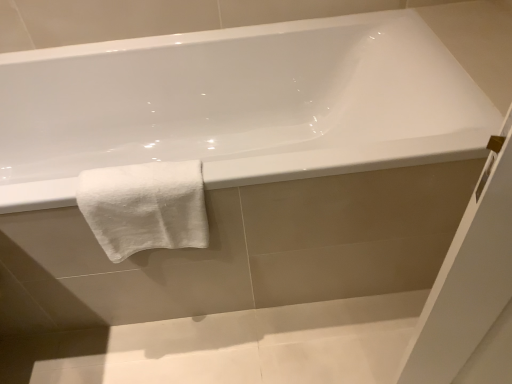
This screenshot has height=384, width=512. Find the location of `white fluffy towel at left`. white fluffy towel at left is located at coordinates (144, 207).

The height and width of the screenshot is (384, 512). What do you see at coordinates (144, 207) in the screenshot?
I see `white fluffy towel at left` at bounding box center [144, 207].

Find the location of a particular element. white fluffy towel at left is located at coordinates (144, 207).